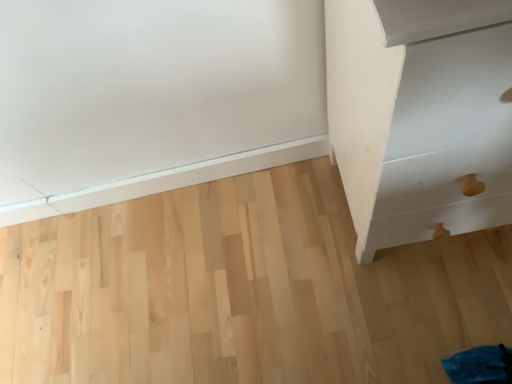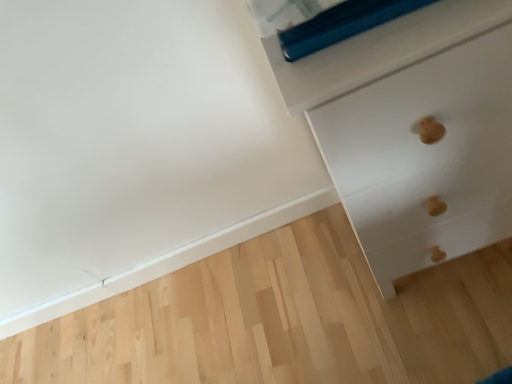
Question: How did the camera likely rotate when shooting the video?

Choices:
 (A) rotated downward
 (B) rotated upward

Answer: (B)